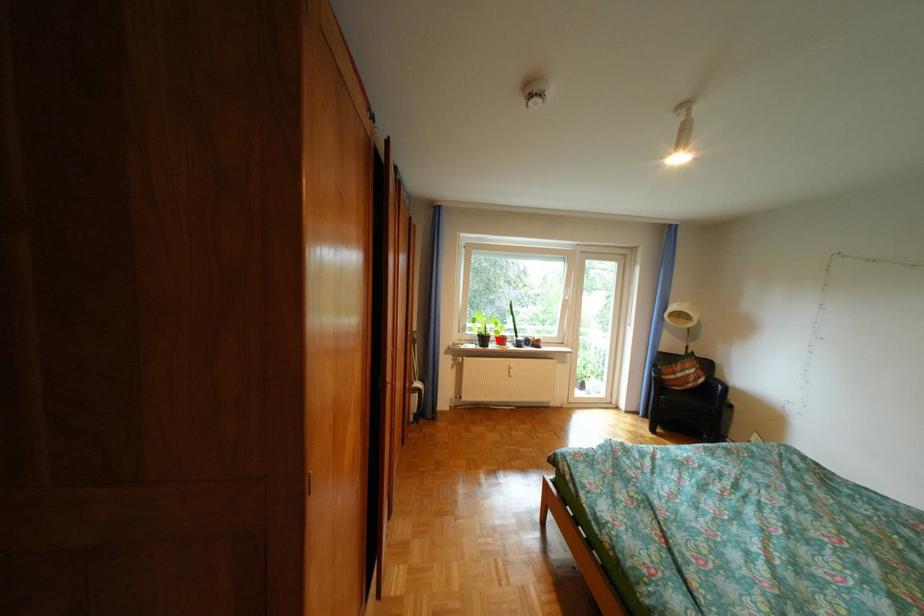
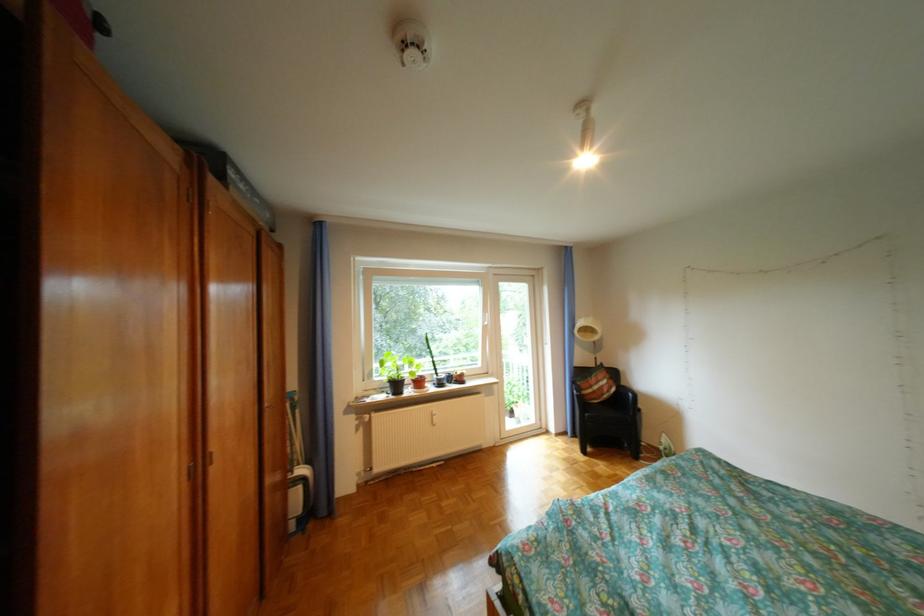
In the second image, find the point that corresponds to the highlighted location in the first image.

(410, 386)